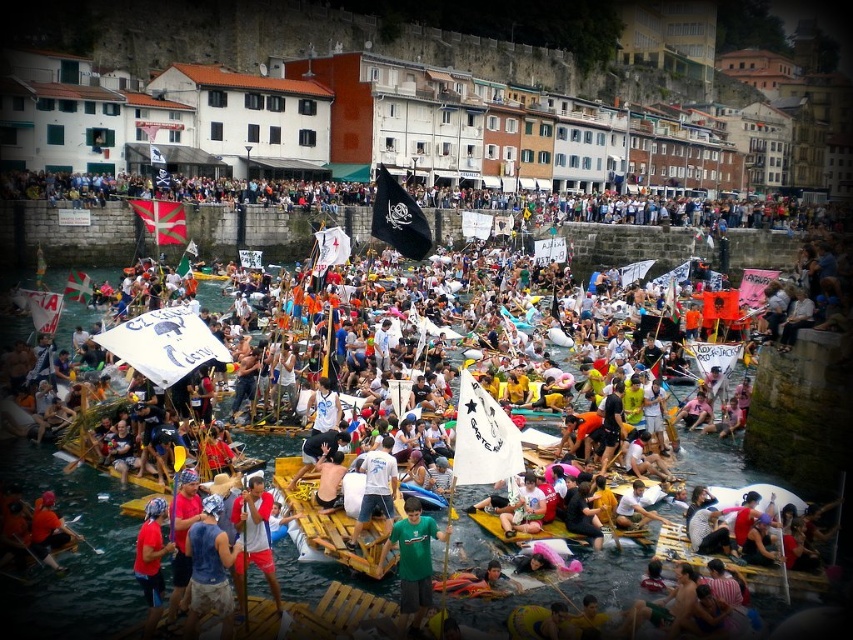
In the scene shown: What is the exact location of the red fabric shirt at center in the image?

The red fabric shirt at center is located at point coordinates of 0.842 on the x axis and 0.298 on the y axis.

You are standing at the point marked as point (300, 204) on the riverbank, and you want to take a photo of the pirate flag raft that is 100 meters away from the camera. Is the distance between you and the camera sufficient to capture the entire pirate flag raft in your photo?

The distance between point (300, 204) and the camera is 95.74 meters. Since the pirate flag raft is 100 meters away from the camera, you are 4.26 meters closer to the camera than the raft. Therefore, the distance between you and the camera is sufficient to capture the entire pirate flag raft in your photo.